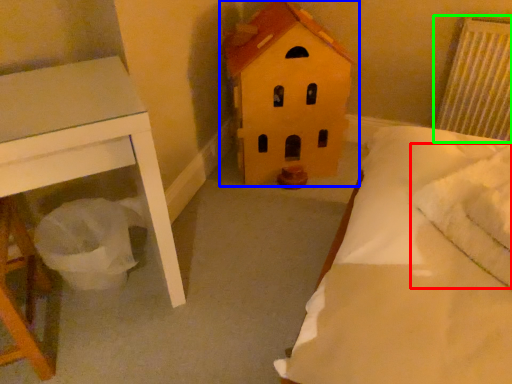
Question: Which is farther away from pillow (highlighted by a red box)? toy (highlighted by a blue box) or radiator (highlighted by a green box)?

Choices:
 (A) toy
 (B) radiator

Answer: (B)